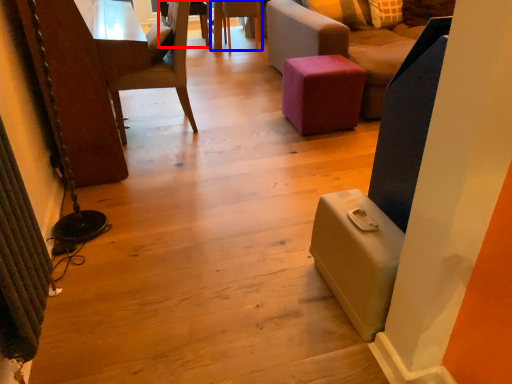
Question: Among these objects, which one is nearest to the camera, chair (highlighted by a red box) or chair (highlighted by a blue box)?

Choices:
 (A) chair
 (B) chair

Answer: (B)